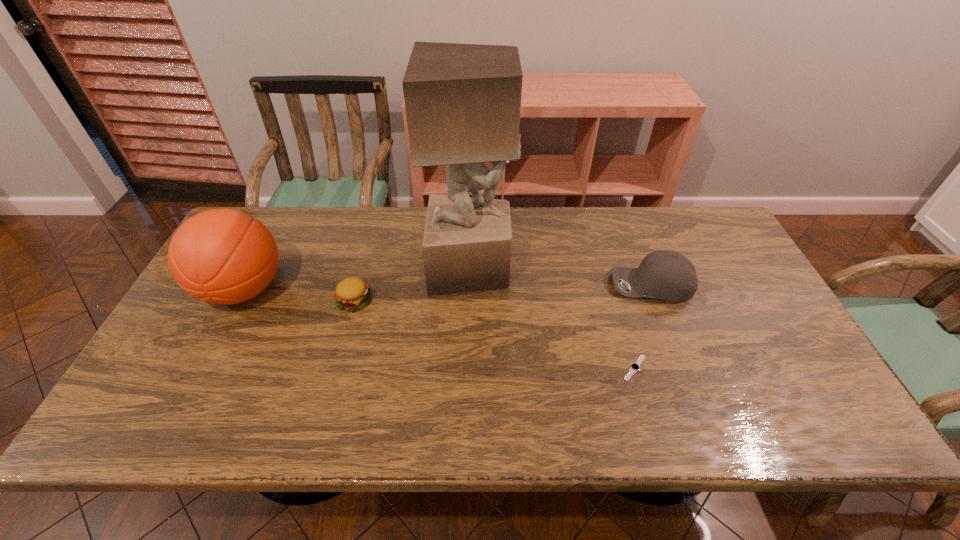
I want to click on free region at the left edge of the desktop, so click(x=170, y=384).

Identify the location of free space at the right edge. (709, 289).

In the image, there is a desktop. At what (x,y) coordinates should I click in order to perform the action: click on vacant space at the far right corner. Please return your answer as a coordinate pair (x, y). Looking at the image, I should click on (689, 223).

Find the location of a particular element. The height and width of the screenshot is (540, 960). unoccupied area between the third tallest object and the third object from left to right is located at coordinates (562, 276).

Where is `blank region between the second object from left to right and the tallest object`? The width and height of the screenshot is (960, 540). blank region between the second object from left to right and the tallest object is located at coordinates (413, 285).

Find the location of a particular element. Image resolution: width=960 pixels, height=540 pixels. vacant area between the sculpture and the fourth object from right to left is located at coordinates (413, 285).

At what (x,y) coordinates should I click in order to perform the action: click on free space between the watch and the second object from left to right. Please return your answer as a coordinate pair (x, y). This screenshot has width=960, height=540. Looking at the image, I should click on (494, 335).

The width and height of the screenshot is (960, 540). In order to click on free space between the hamburger and the shortest object in this screenshot , I will do `click(494, 335)`.

Locate an element on the screen. empty space that is in between the third object from right to left and the second shortest object is located at coordinates (413, 285).

I want to click on free space between the nearest object and the second object from left to right, so 494,335.